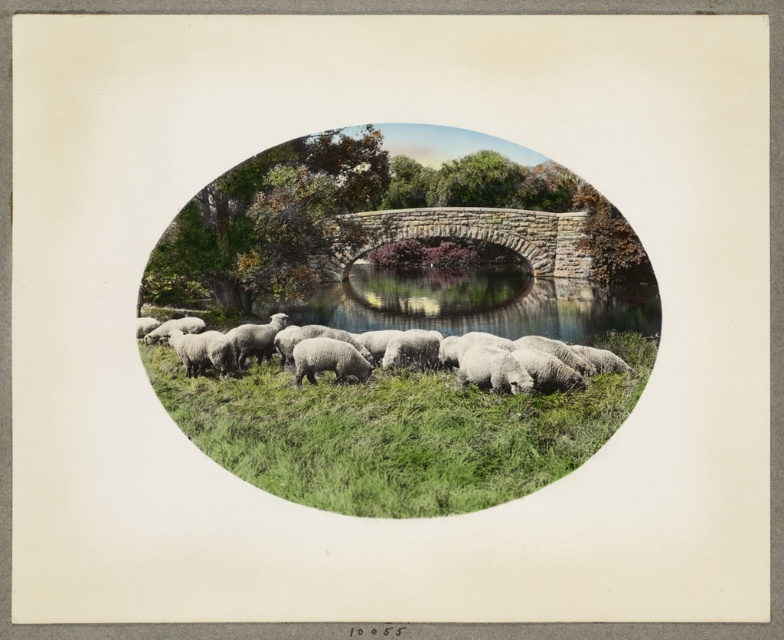
You are an artist painting this scene and want to place a signature in the lower right corner of the oval border. To ensure the signature doesn not overlap with the main subject, which is the white woolen sheep at center, where should you place your signature relative to the point at coordinates point (394, 330)?

The white woolen sheep at center is located at point (394, 330). To place your signature in the lower right corner of the oval border without overlapping, position it to the lower right of point (394, 330).

You are standing at the center of the image and want to walk towards the point labeled as point [394,432]. Based on the scene description, what type of terrain will you encounter there?

The point [394,432] corresponds to green soft grass at lower center, so you will encounter soft grass terrain there.